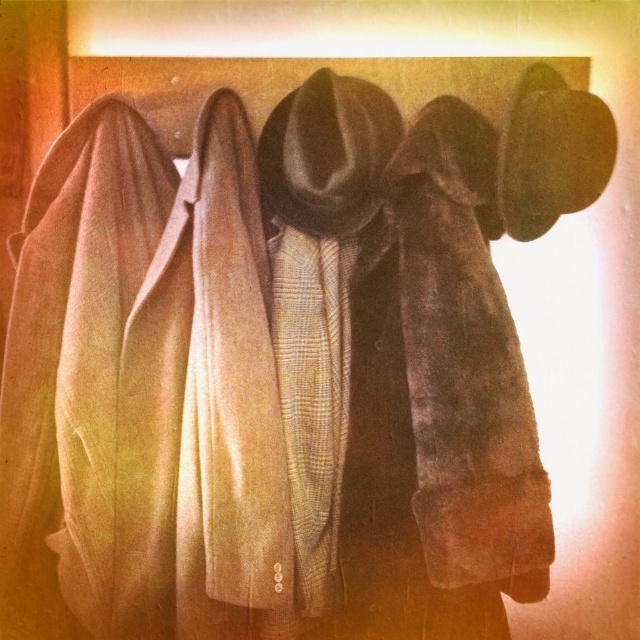
You are organizing a winter clothing display and need to place the brown fur scarf at center and the plaid wool scarf at center on a shelf. The shelf has a width of 1 meter. If you want to place both scarves side by side without overlapping, will their combined width exceed the shelf space?

The brown fur scarf at center is wider than the plaid wool scarf at center. However, since the exact widths are not provided, we cannot determine if their combined width exceeds 1 meter. More information is needed.

You are organizing a winter clothing display and need to decide which scarf to place on top. Based on the image, which scarf should you choose between the brown fur scarf at center and the plaid wool scarf at center?

The brown fur scarf at center has a larger size compared to the plaid wool scarf at center, so it should be placed on top to ensure visibility.

You are standing in front of the wooden coat rack and want to hang a new item between the two light beige jackets. Where should you place it in relation to the brown fur scarf at center?

The brown fur scarf at center is located at coordinates approximately 0.570 on the x and 0.727 on the y axis. Since you want to place the new item between the two light beige jackets, you should position it to the left of the brown fur scarf at center.